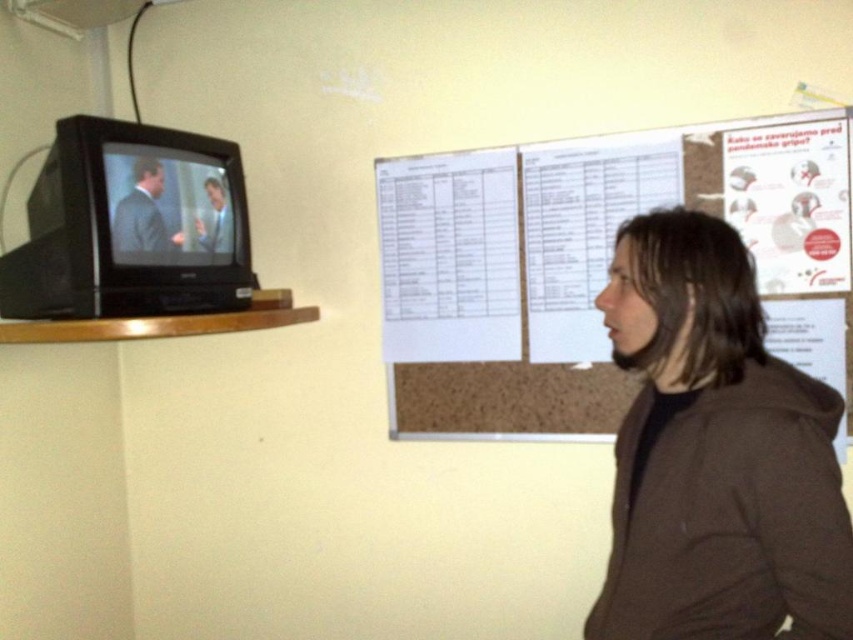
Question: Which of the following is the farthest from the observer?

Choices:
 (A) brown matte jacket at center
 (B) smooth skin man at upper left
 (C) matte black suit at upper left
 (D) white paper at upper center

Answer: (B)

Question: Is white paper at upper center above brown matte jacket at center?

Choices:
 (A) no
 (B) yes

Answer: (B)

Question: Is white paper at upper center above brown matte jacket at center?

Choices:
 (A) yes
 (B) no

Answer: (A)

Question: Which of the following is the closest to the observer?

Choices:
 (A) (799, 285)
 (B) (836, 413)
 (C) (141, 200)

Answer: (B)

Question: Is white paper at upper center in front of matte black suit at upper left?

Choices:
 (A) no
 (B) yes

Answer: (A)

Question: Considering the real-world distances, which object is farthest from the matte black suit at upper left?

Choices:
 (A) brown matte jacket at center
 (B) smooth skin man at upper left
 (C) white paper at upper center

Answer: (A)